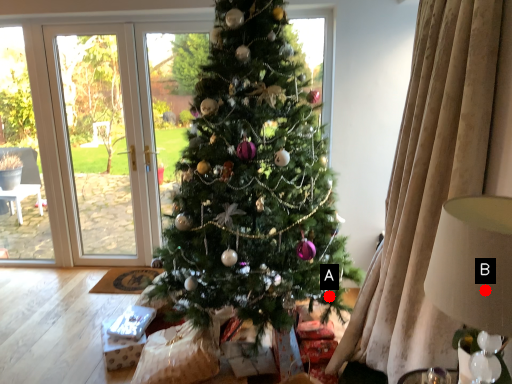
Question: Two points are circled on the image, labeled by A and B beside each circle. Which point is farther from the camera taking this photo?

Choices:
 (A) A is further
 (B) B is further

Answer: (A)